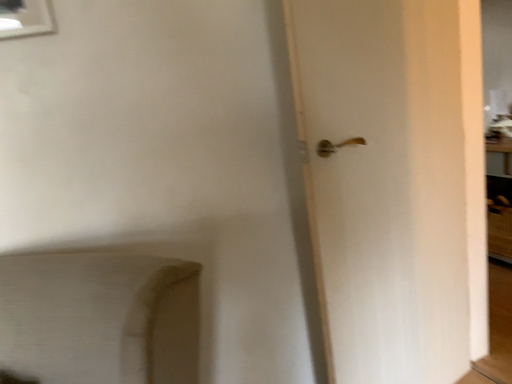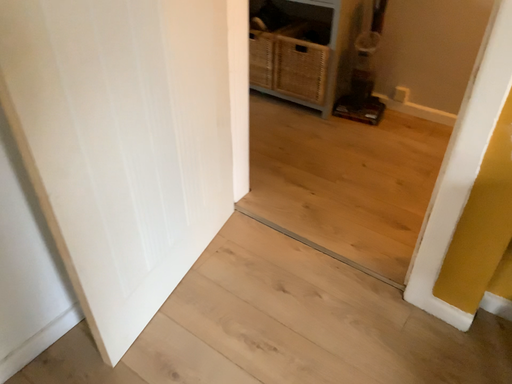
Question: Which way did the camera rotate in the video?

Choices:
 (A) rotated downward
 (B) rotated upward

Answer: (A)